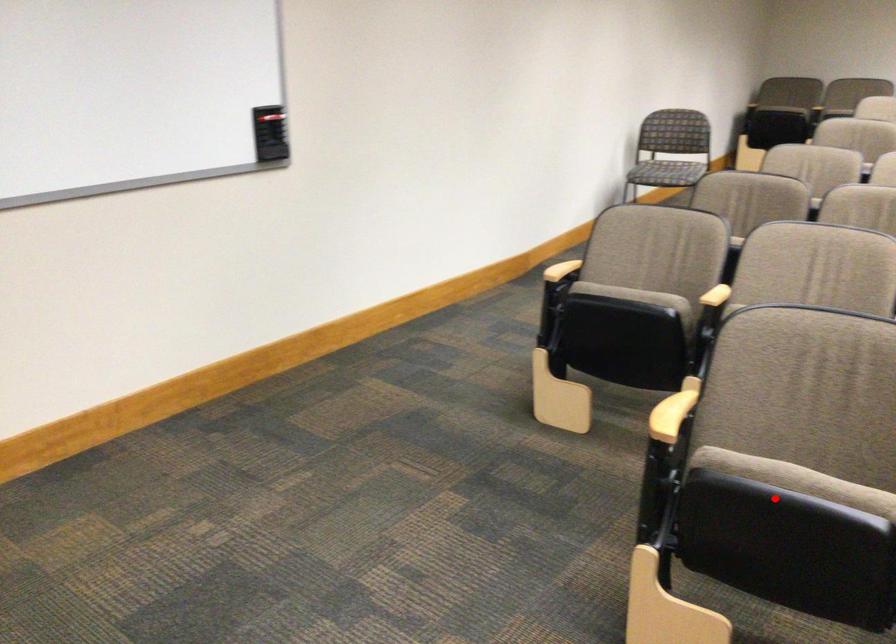
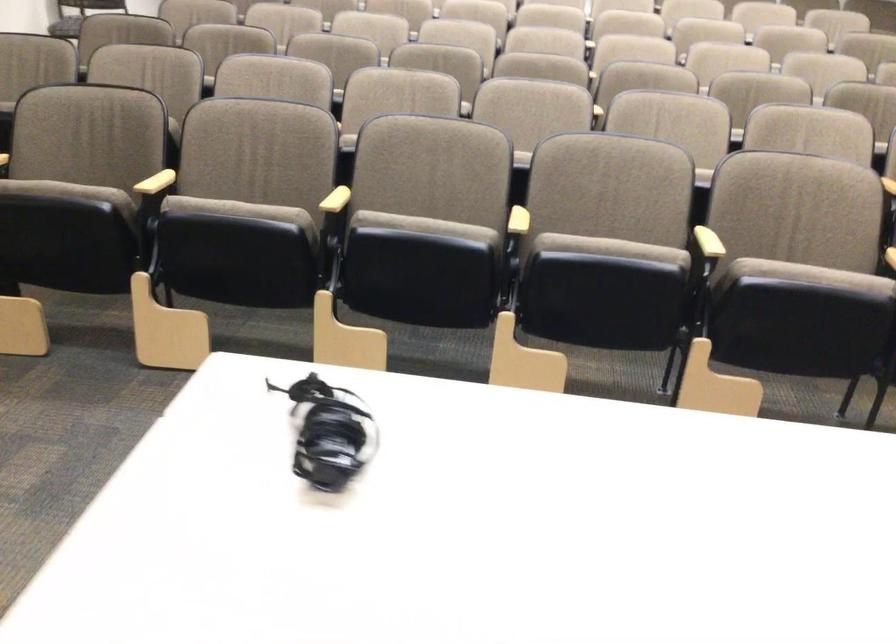
In the second image, find the point that corresponds to the highlighted location in the first image.

(69, 192)